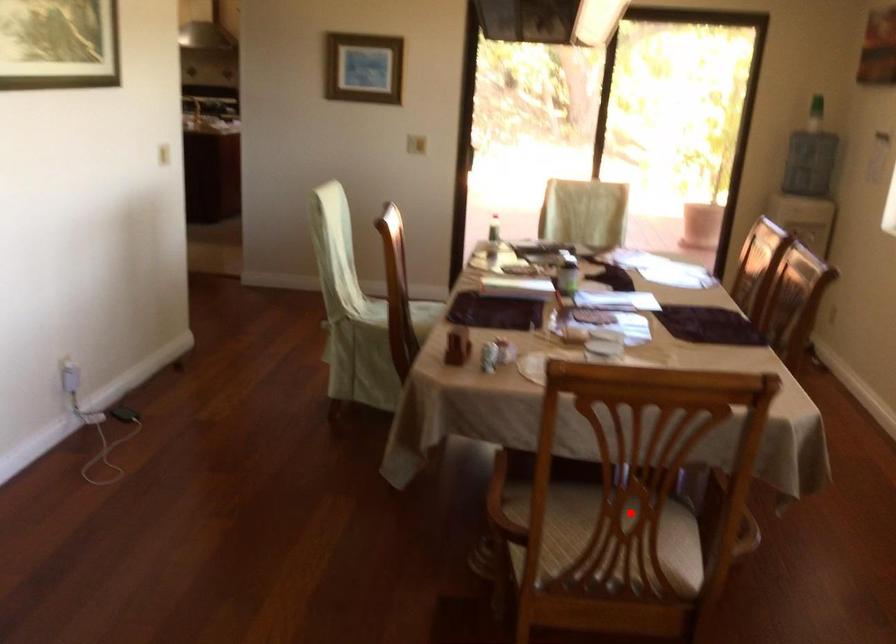
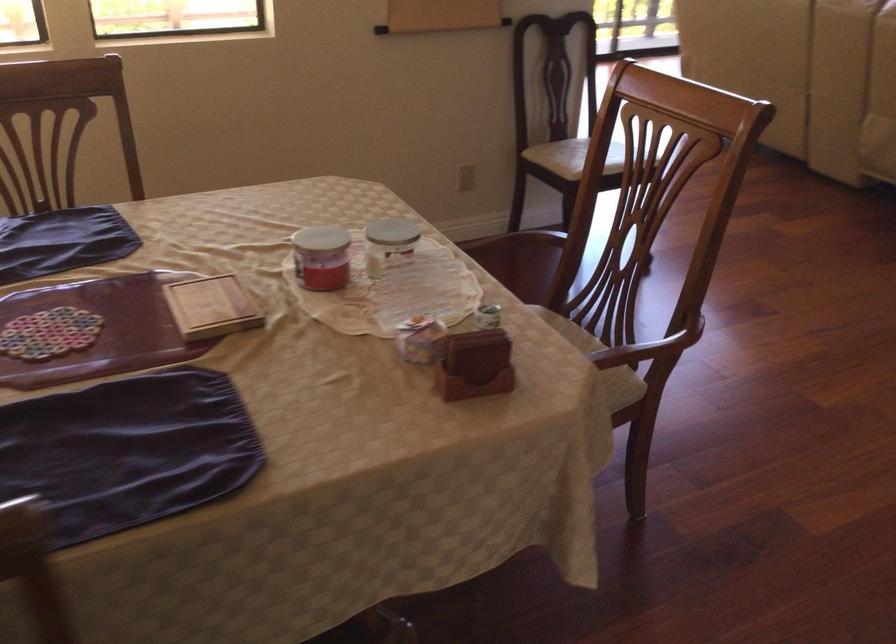
Question: I am providing you with two images of the same scene from different viewpoints. A red point is marked on the first image. Can you still see the location of the red point in image 2?

Choices:
 (A) Yes
 (B) No

Answer: (B)